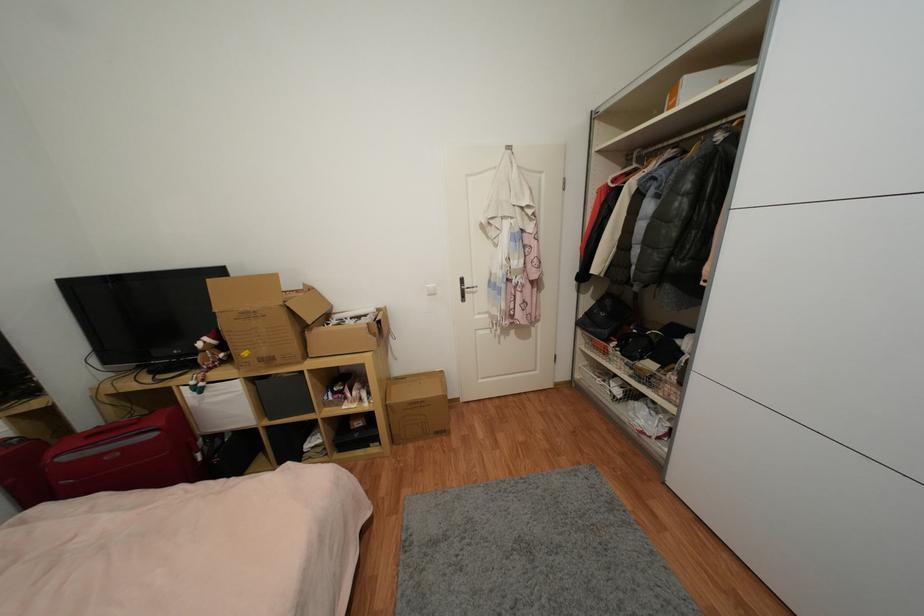
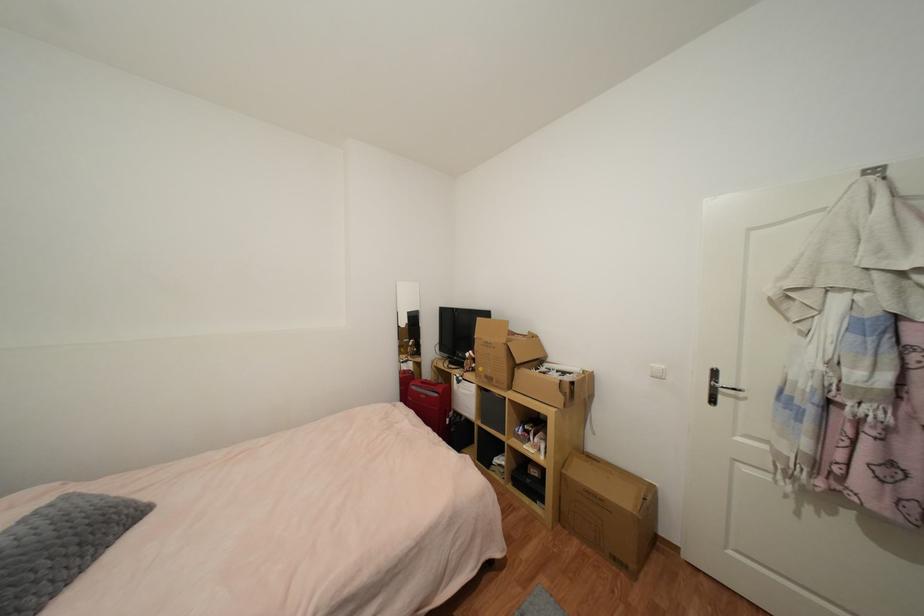
Locate, in the second image, the point that corresponds to point 467,282 in the first image.

(720, 374)